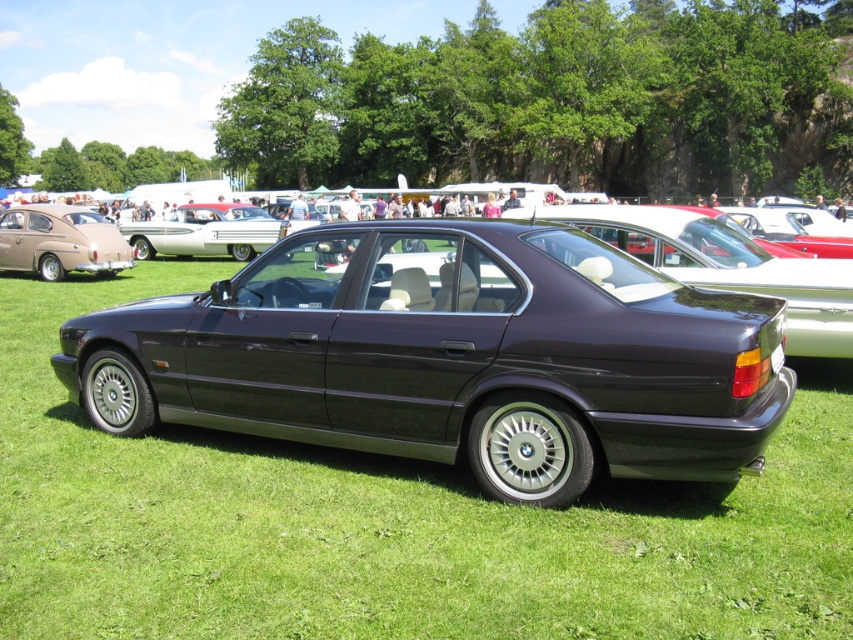
In the scene shown: You are a photographer at a car show. You need to capture a photo that includes both the satin dark blue sedan at center and the matte brown car at left. Based on their positions, which car should be placed closer to the bottom of the frame?

The satin dark blue sedan at center should be placed closer to the bottom of the frame because it is positioned below the matte brown car at left.